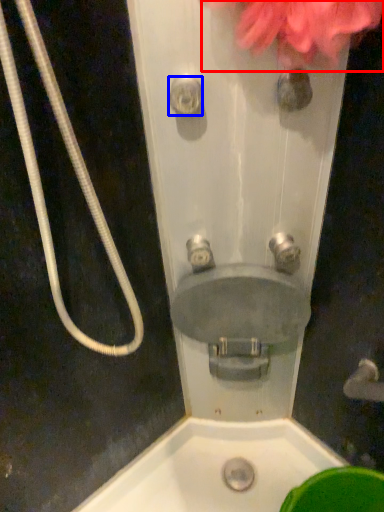
Question: Which object is closer to the camera taking this photo, flower (highlighted by a red box) or shower (highlighted by a blue box)?

Choices:
 (A) flower
 (B) shower

Answer: (A)